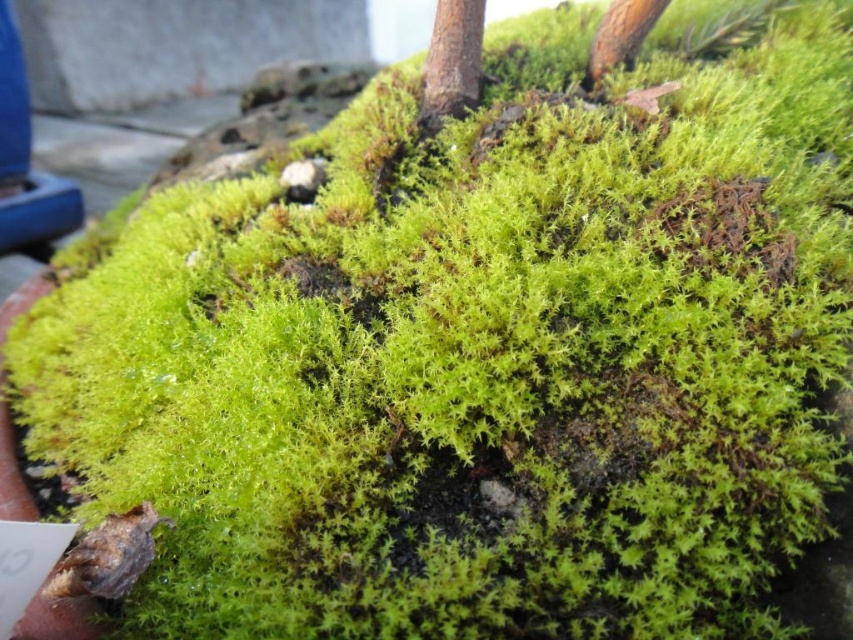
Can you confirm if smooth brown tree trunk at upper center is shorter than brown rough wood at upper right?

No.

Is smooth brown tree trunk at upper center wider than brown rough wood at upper right?

No.

Who is more distant from viewer, (456,10) or (653,13)?

The point (653,13) is more distant.

Find the location of a particular element. This screenshot has width=853, height=640. smooth brown tree trunk at upper center is located at coordinates (451, 61).